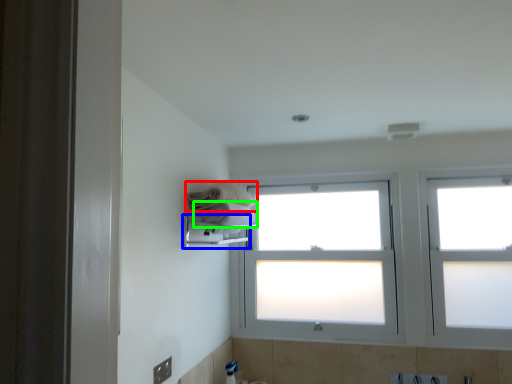
Question: Which object is the farthest from towel (highlighted by a red box)? Choose among these: towel bar (highlighted by a blue box) or towel (highlighted by a green box).

Choices:
 (A) towel bar
 (B) towel

Answer: (A)